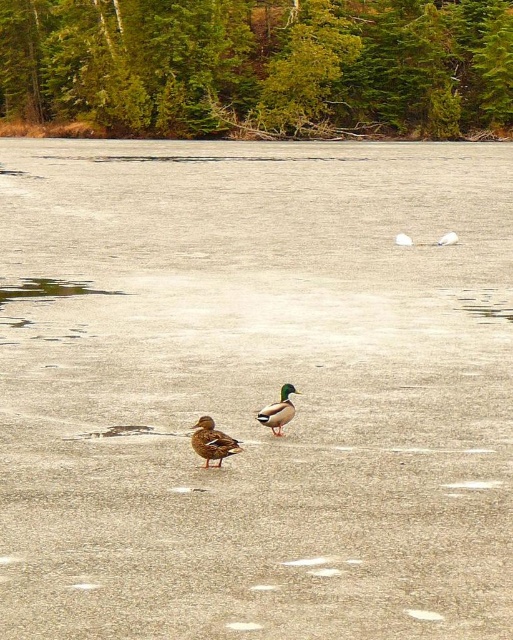
Can you confirm if brown matte duck at center is taller than green matte duck at center?

No.

The height and width of the screenshot is (640, 513). Identify the location of brown matte duck at center. (211, 442).